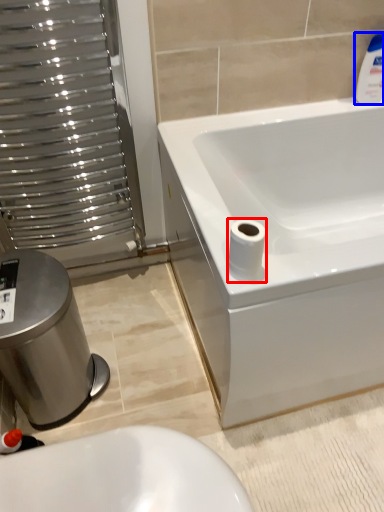
Question: Which of the following is the closest to the observer, toilet paper (highlighted by a red box) or cleaning product (highlighted by a blue box)?

Choices:
 (A) toilet paper
 (B) cleaning product

Answer: (A)